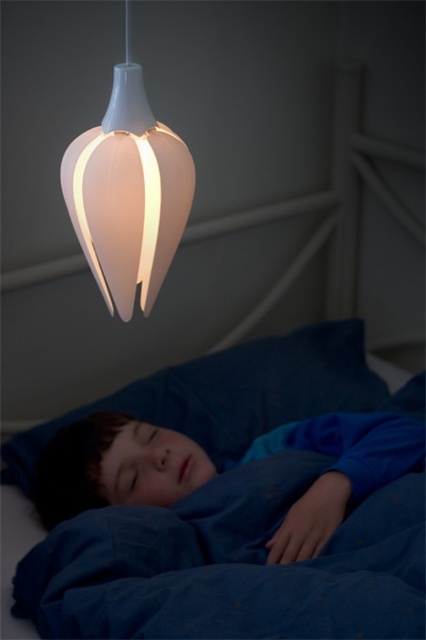
Question: Which point is farther to the camera?

Choices:
 (A) white matte lampshade at upper center
 (B) blue soft fabric at lower center
 (C) blue fabric pillow at lower center

Answer: (C)

Question: Where is blue fabric pillow at lower center located in relation to white matte lampshade at upper center in the image?

Choices:
 (A) left
 (B) right

Answer: (B)

Question: Can you confirm if blue fabric pillow at lower center is thinner than white matte lampshade at upper center?

Choices:
 (A) yes
 (B) no

Answer: (B)

Question: Considering the real-world distances, which object is farthest from the blue soft fabric at lower center?

Choices:
 (A) blue fabric pillow at lower center
 (B) white matte lampshade at upper center

Answer: (B)

Question: Is the position of blue soft fabric at lower center more distant than that of white matte lampshade at upper center?

Choices:
 (A) yes
 (B) no

Answer: (A)

Question: Which is nearer to the blue soft fabric at lower center?

Choices:
 (A) white matte lampshade at upper center
 (B) blue fabric pillow at lower center

Answer: (B)